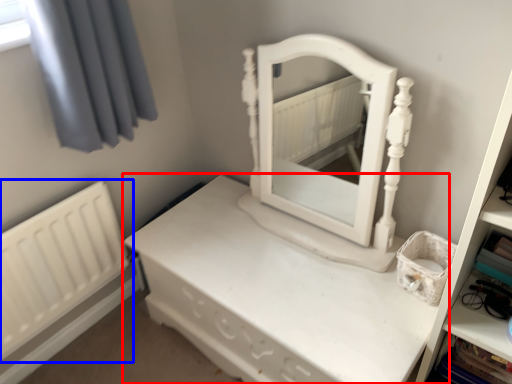
Question: Among these objects, which one is nearest to the camera, nightstand (highlighted by a red box) or radiator (highlighted by a blue box)?

Choices:
 (A) nightstand
 (B) radiator

Answer: (A)